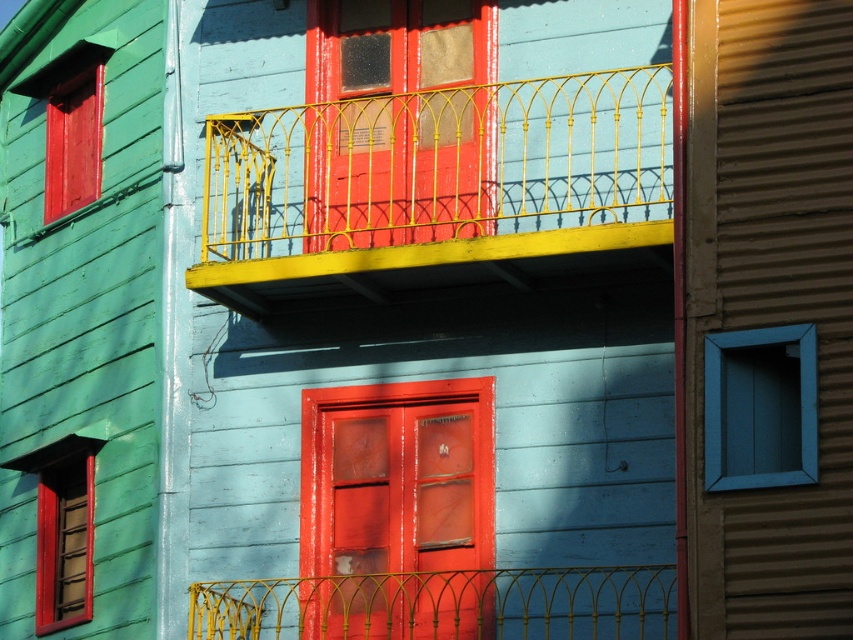
You are standing in front of the building and want to know which yellow structure is closer to you. The structures are the yellow wrought iron balcony at upper center and the yellow wire mesh at center. Can you determine which one is closer?

The yellow wrought iron balcony at upper center is closer to you because it is further to the viewer than the yellow wire mesh at center.

You are an architect designing a new building and want to ensure that the yellow wrought iron balcony at upper center and the blue wood window at right are proportionally balanced. Based on the image, which object takes up more space in the design?

The blue wood window at right takes up more space than the yellow wrought iron balcony at upper center because the balcony occupies less space than the window according to the description.